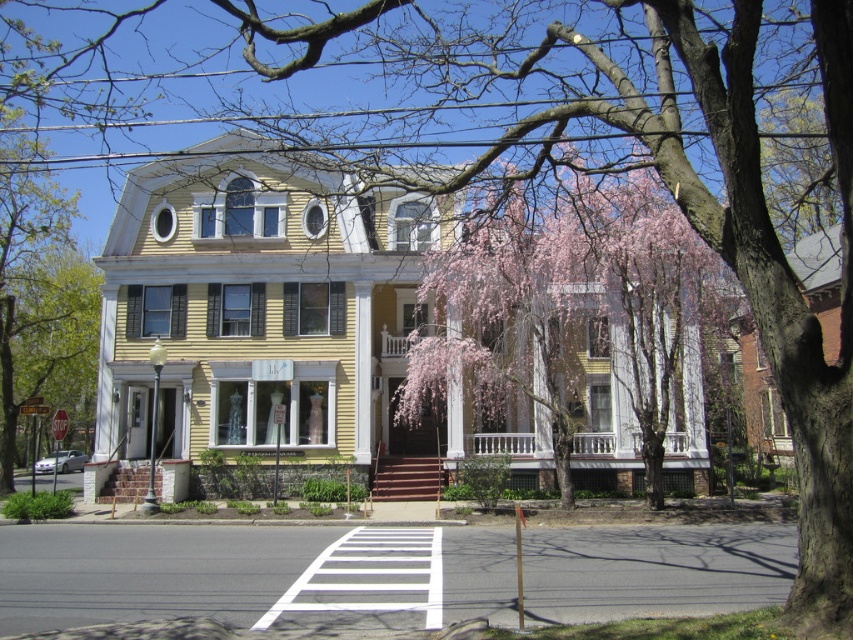
You are a painter standing on the white painted wood porch at center, holding a ladder. You want to paint the pink blossoming branches at center. Can you reach them with a 10 feet ladder?

The pink blossoming branches at center is 19.12 feet from white painted wood porch at center, so the 10 feet ladder is not long enough to reach them.

You are standing in front of the house and notice the pink blossoming branches at center. Where exactly are they located in relation to the house?

The pink blossoming branches at center are located at the central area of the house, as their 2D coordinates are at point (566, 314).

You are a painter planning to paint the front of the house. You need to decide which area requires more paint between the pink blossoming branches at center and the white painted wood porch at center. Which one will need more paint?

The pink blossoming branches at center has a larger width than the white painted wood porch at center, so it will need more paint.